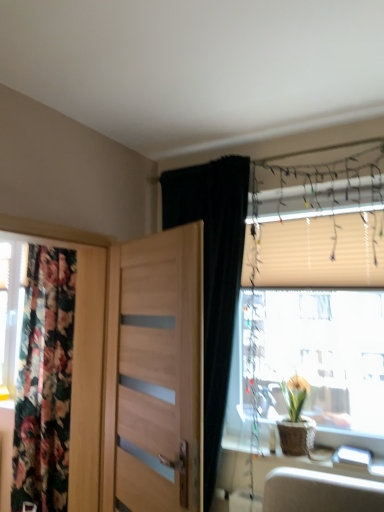
Question: Relative to wooden table at right, is beige fabric blind at upper right in front or behind?

Choices:
 (A) front
 (B) behind

Answer: (B)

Question: Considering the positions of beige fabric blind at upper right and wooden table at right in the image, is beige fabric blind at upper right taller or shorter than wooden table at right?

Choices:
 (A) short
 (B) tall

Answer: (B)

Question: Based on their relative distances, which object is farther from the floral fabric curtain at left, positioned as the 2th curtain in right-to-left order?

Choices:
 (A) beige fabric blind at upper right
 (B) translucent plastic window at right
 (C) matte brown pot at window
 (D) light wood door at center
 (E) black velvet curtain at upper center, the 1th curtain from the right

Answer: (A)

Question: Based on their relative distances, which object is farther from the floral fabric curtain at left, positioned as the 2th curtain in right-to-left order?

Choices:
 (A) translucent plastic window at right
 (B) wooden table at right
 (C) black velvet curtain at upper center, which is the second curtain in back-to-front order
 (D) matte brown pot at window
 (E) light wood door at center

Answer: (D)